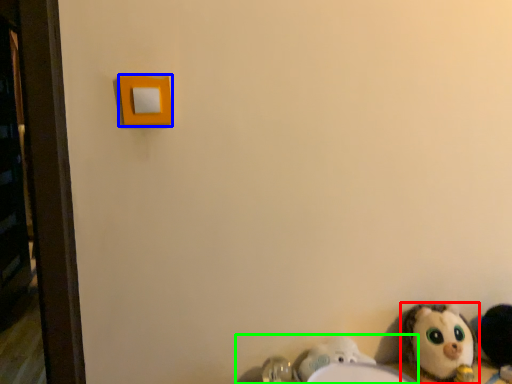
Question: Based on their relative distances, which object is farther from toy (highlighted by a red box)? Choose from light switch (highlighted by a blue box) and sink (highlighted by a green box).

Choices:
 (A) light switch
 (B) sink

Answer: (A)